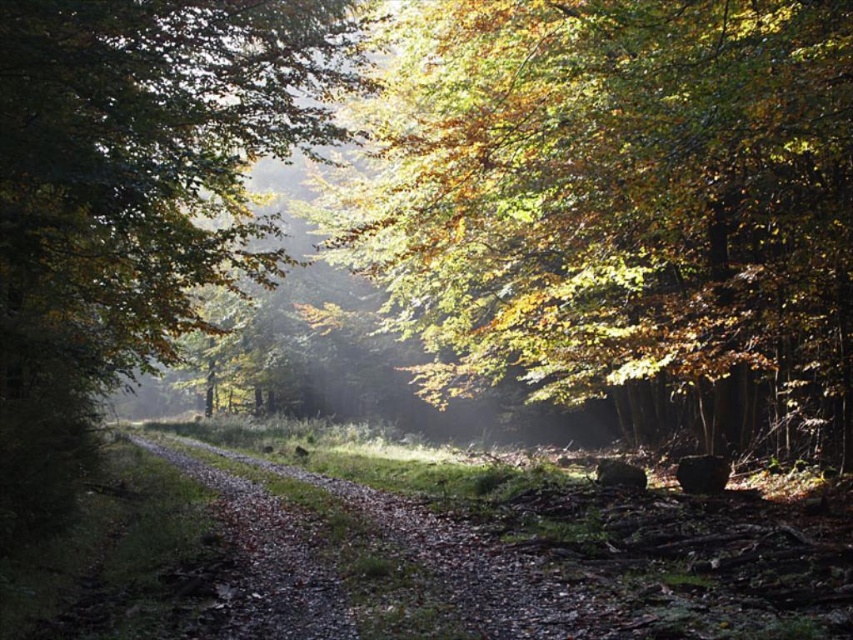
You are a hiker carrying a backpack and need to pass between the golden leafy tree at center and the green leafy tree at center. The width of your backpack is 0.8 meters. Can you safely walk through the gap between them without touching either tree?

The distance between the golden leafy tree at center and the green leafy tree at center is 5.20 meters. Since your backpack is only 0.8 meters wide, there is ample space to pass through the gap safely without touching either tree.

You are standing at the starting point of the forest path and want to find the golden leafy tree at center. According to the scene description, where should you look relative to your position?

The golden leafy tree at center is located at the central focus of the scene, so you should look straight ahead along the path to find it.